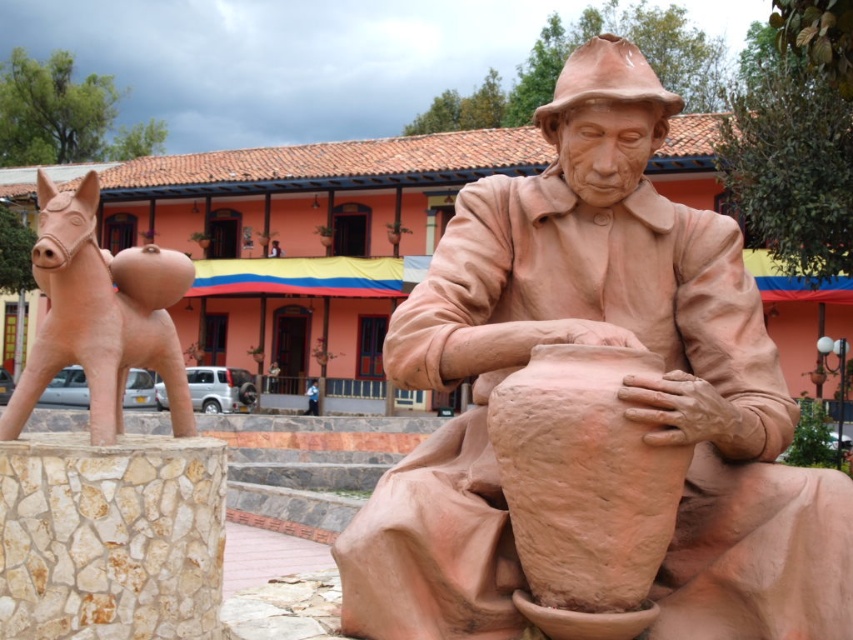
You are an art student observing the sculpture in the plaza. You notice the matte clay potter at center and the matte clay horse at left. Which sculpture is taller?

The matte clay horse at left is taller than the matte clay potter at center.

You are an art student observing the sculpture in the plaza. You notice the matte clay potter at center and the matte clay horse at left. Which sculpture is larger in size?

The matte clay horse at left is larger in size compared to the matte clay potter at center.

You are an art student observing the sculpture of the matte clay potter at center and the matte clay horse at left. Which sculpture has a smaller width?

The matte clay potter at center has a lesser width compared to the matte clay horse at left, so the matte clay potter at center is smaller in width.